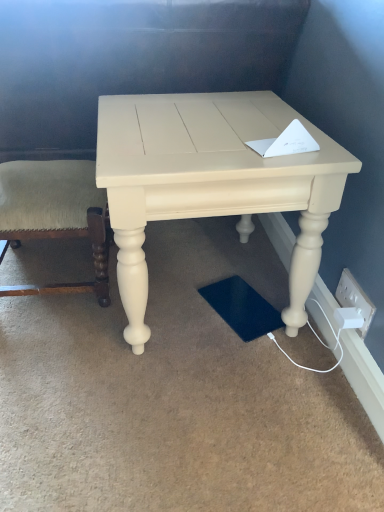
This screenshot has height=512, width=384. I want to click on vacant space underneath matte cream table at center (from a real-world perspective), so (200, 293).